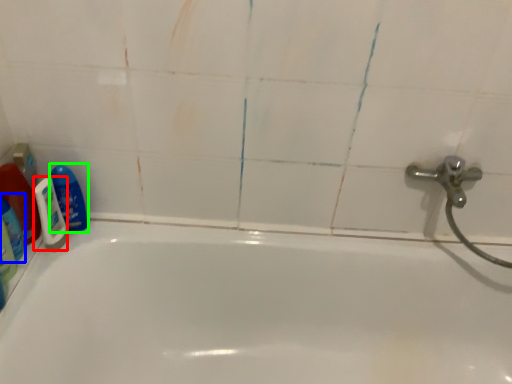
Question: Based on their relative distances, which object is nearer to shaving cream (highlighted by a red box)? Choose from cleaning product (highlighted by a blue box) and cleaning product (highlighted by a green box).

Choices:
 (A) cleaning product
 (B) cleaning product

Answer: (B)